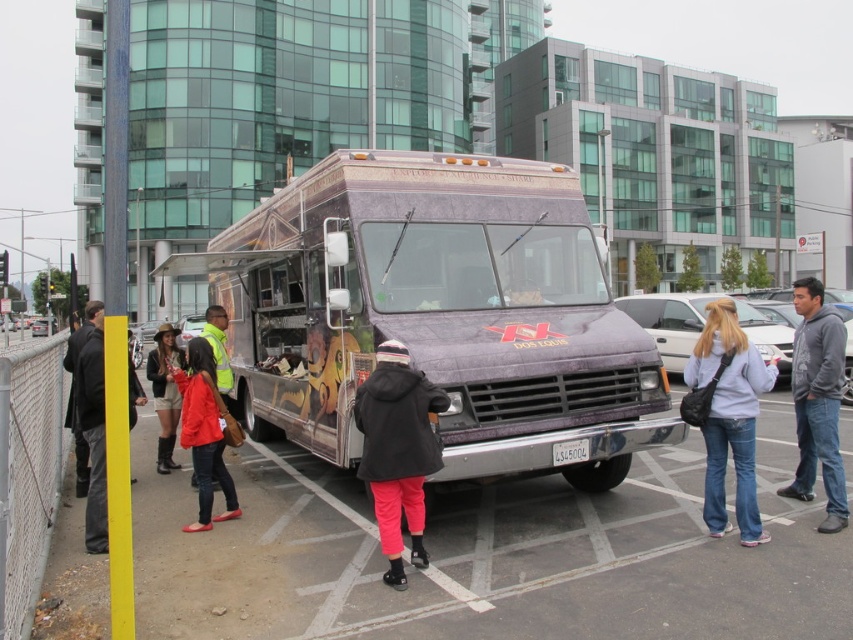
Between point (196, 339) and point (164, 369), which one is positioned behind?

Point (164, 369)

Who is more distant from viewer, (199, 465) or (167, 403)?

The point (167, 403) is behind.

This screenshot has height=640, width=853. I want to click on matte red jacket at lower left, so click(206, 429).

Between point (613, 456) and point (91, 520), which one is positioned in front?

Point (91, 520) is more forward.

Is matte purple van at center positioned behind yellow matte pole at left?

No, matte purple van at center is in front of yellow matte pole at left.

Is point (541, 401) closer to viewer compared to point (103, 465)?

No, (541, 401) is further to viewer.

At what (x,y) coordinates should I click in order to perform the action: click on matte purple van at center. Please return your answer as a coordinate pair (x, y). The width and height of the screenshot is (853, 640). Looking at the image, I should click on (437, 314).

Is matte purple van at center thinner than black matte coat at center?

No, matte purple van at center is not thinner than black matte coat at center.

Can you confirm if matte purple van at center is positioned to the right of black matte coat at center?

In fact, matte purple van at center is to the left of black matte coat at center.

Is point (412, 172) positioned behind point (387, 576)?

Yes, point (412, 172) is farther from viewer.

Where is `matte purple van at center`? matte purple van at center is located at coordinates (437, 314).